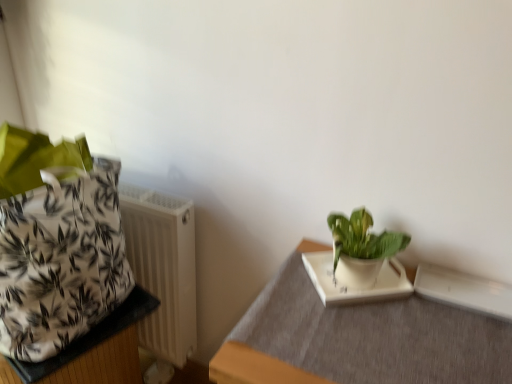
Question: Does white plastic radiator at left appear on the left side of green glossy plant at upper right?

Choices:
 (A) no
 (B) yes

Answer: (B)

Question: From the image's perspective, is white plastic radiator at left located above green glossy plant at upper right?

Choices:
 (A) yes
 (B) no

Answer: (B)

Question: Does white plastic radiator at left have a larger size compared to green glossy plant at upper right?

Choices:
 (A) yes
 (B) no

Answer: (A)

Question: Can you confirm if white plastic radiator at left is thinner than green glossy plant at upper right?

Choices:
 (A) no
 (B) yes

Answer: (B)

Question: From the image's perspective, would you say white plastic radiator at left is shown under green glossy plant at upper right?

Choices:
 (A) yes
 (B) no

Answer: (A)

Question: Considering the positions of white fabric bag at left, the 1th table from the left, and green glossy plant at upper right in the image, is white fabric bag at left, the 1th table from the left, taller or shorter than green glossy plant at upper right?

Choices:
 (A) short
 (B) tall

Answer: (B)

Question: Looking at the image, does white fabric bag at left, which is the 2th table from right to left, seem bigger or smaller compared to green glossy plant at upper right?

Choices:
 (A) small
 (B) big

Answer: (B)

Question: Which is correct: white fabric bag at left, the 1th table from the left, is inside green glossy plant at upper right, or outside of it?

Choices:
 (A) inside
 (B) outside

Answer: (B)

Question: Relative to green glossy plant at upper right, is white fabric bag at left, the 1th table from the left, in front or behind?

Choices:
 (A) behind
 (B) front

Answer: (A)

Question: Is point (252, 349) closer or farther from the camera than point (50, 327)?

Choices:
 (A) farther
 (B) closer

Answer: (B)

Question: Considering the positions of white matte tray at lower right, which is the second table in left-to-right order, and white matte flowerpot at left in the image, is white matte tray at lower right, which is the second table in left-to-right order, wider or thinner than white matte flowerpot at left?

Choices:
 (A) thin
 (B) wide

Answer: (A)

Question: Relative to white matte flowerpot at left, is white matte tray at lower right, which is the first table from right to left, in front or behind?

Choices:
 (A) front
 (B) behind

Answer: (A)

Question: In terms of size, does white matte tray at lower right, which is the second table in left-to-right order, appear bigger or smaller than white matte flowerpot at left?

Choices:
 (A) big
 (B) small

Answer: (B)

Question: Based on their positions, is green glossy plant at upper right located to the left or right of white matte flowerpot at left?

Choices:
 (A) right
 (B) left

Answer: (A)

Question: Would you say green glossy plant at upper right is inside or outside white matte flowerpot at left?

Choices:
 (A) outside
 (B) inside

Answer: (A)